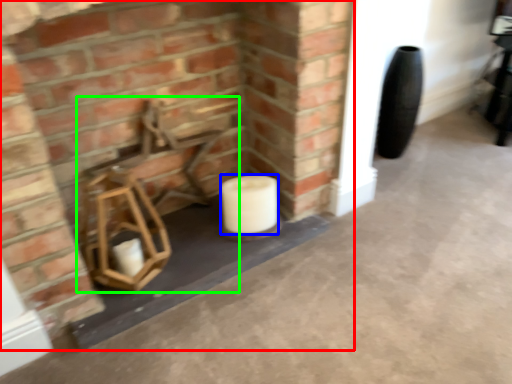
Question: Which object is the farthest from fireplace (highlighted by a red box)? Choose among these: toilet paper (highlighted by a blue box) or chair (highlighted by a green box).

Choices:
 (A) toilet paper
 (B) chair

Answer: (A)